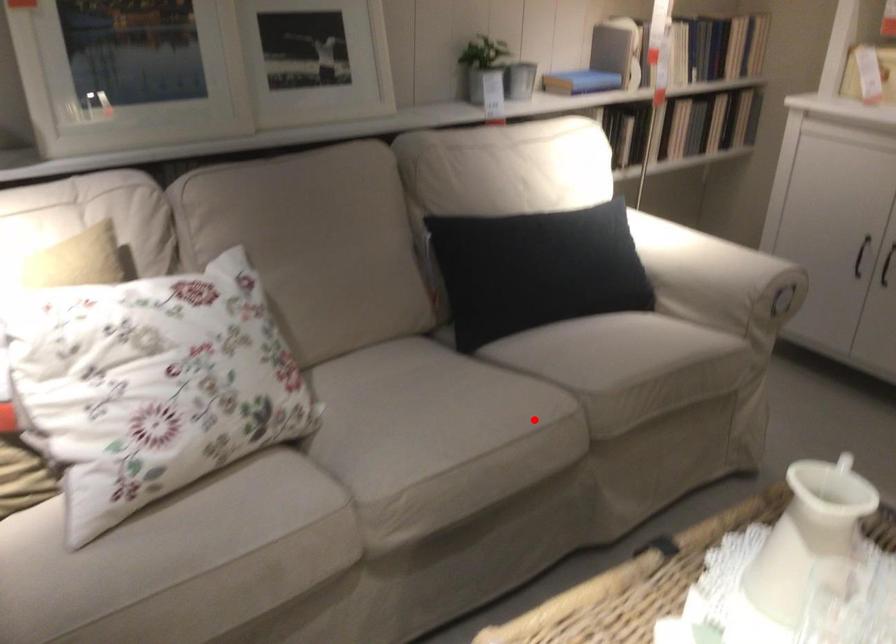
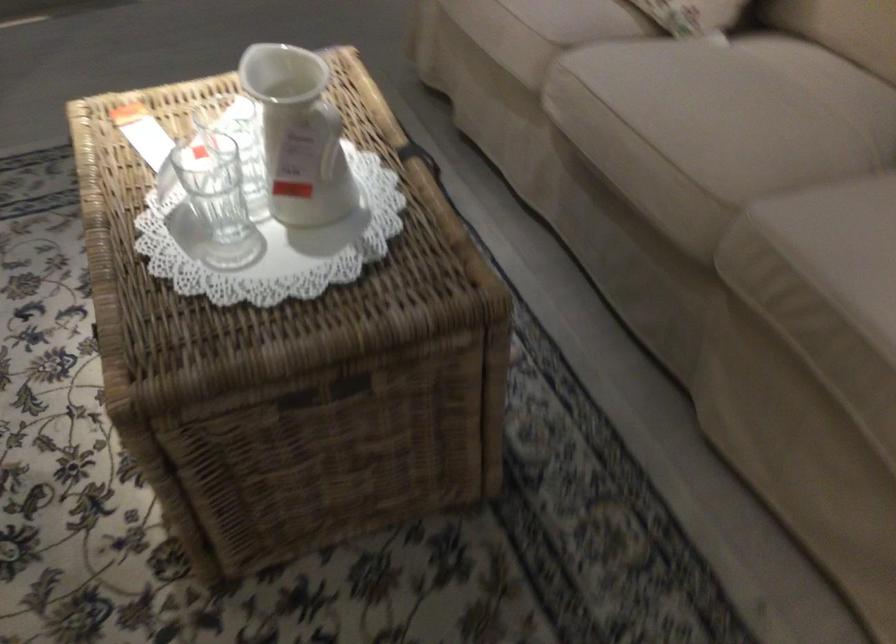
Question: I am providing you with two images of the same scene from different viewpoints. A red point is shown in image1. For the corresponding object point in image2, is it positioned nearer or farther from the camera?

Choices:
 (A) Nearer
 (B) Farther

Answer: (A)